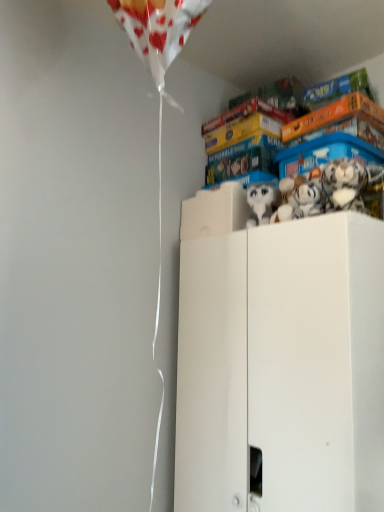
Question: Can you confirm if white plush toy at upper right, which is the second toy in left-to-right order, is thinner than white matte cabinet at upper right?

Choices:
 (A) yes
 (B) no

Answer: (A)

Question: Is white plush toy at upper right, the second toy from the right, to the right of white matte cabinet at upper right from the viewer's perspective?

Choices:
 (A) yes
 (B) no

Answer: (B)

Question: Is white plush toy at upper right, the second toy from the right, oriented towards white matte cabinet at upper right?

Choices:
 (A) no
 (B) yes

Answer: (A)

Question: Is white matte cabinet at upper right completely or partially inside white plush toy at upper right, which is the second toy in left-to-right order?

Choices:
 (A) no
 (B) yes

Answer: (A)

Question: Is the position of white plush toy at upper right, the second toy from the right, less distant than that of white matte cabinet at upper right?

Choices:
 (A) yes
 (B) no

Answer: (B)

Question: From a real-world perspective, is white plush toy at upper right, which is the second toy in left-to-right order, beneath white matte cabinet at upper right?

Choices:
 (A) no
 (B) yes

Answer: (A)

Question: Is white matte cabinet at upper right looking in the opposite direction of white plush toy at upper right, which is the second toy in left-to-right order?

Choices:
 (A) no
 (B) yes

Answer: (A)

Question: Is white matte cabinet at upper right located outside white plush toy at upper right, the second toy from the right?

Choices:
 (A) yes
 (B) no

Answer: (A)

Question: From the image's perspective, is white matte cabinet at upper right located beneath white plush toy at upper right, which is the second toy in left-to-right order?

Choices:
 (A) no
 (B) yes

Answer: (B)

Question: Considering the relative sizes of white matte cabinet at upper right and white plush toy at upper right, the second toy from the right, in the image provided, is white matte cabinet at upper right bigger than white plush toy at upper right, the second toy from the right,?

Choices:
 (A) no
 (B) yes

Answer: (B)

Question: Does white matte cabinet at upper right come behind white plush toy at upper right, the second toy from the right?

Choices:
 (A) yes
 (B) no

Answer: (B)

Question: Is white matte cabinet at upper right taller than white plush toy at upper right, which is the second toy in left-to-right order?

Choices:
 (A) yes
 (B) no

Answer: (A)

Question: Considering the relative sizes of white plush toy at upper right, which is the third toy from left to right, and white matte cabinet at upper right in the image provided, is white plush toy at upper right, which is the third toy from left to right, bigger than white matte cabinet at upper right?

Choices:
 (A) no
 (B) yes

Answer: (A)